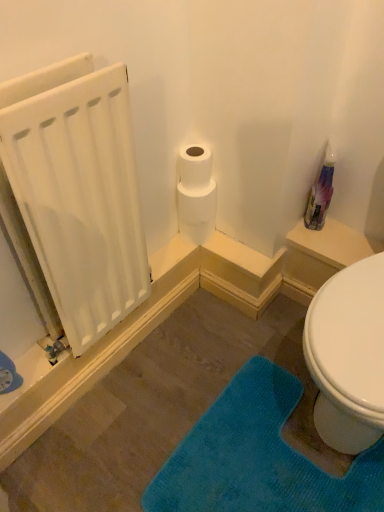
The height and width of the screenshot is (512, 384). Identify the location of free space below teal plush bath mat at lower right (from a real-world perspective). (245, 463).